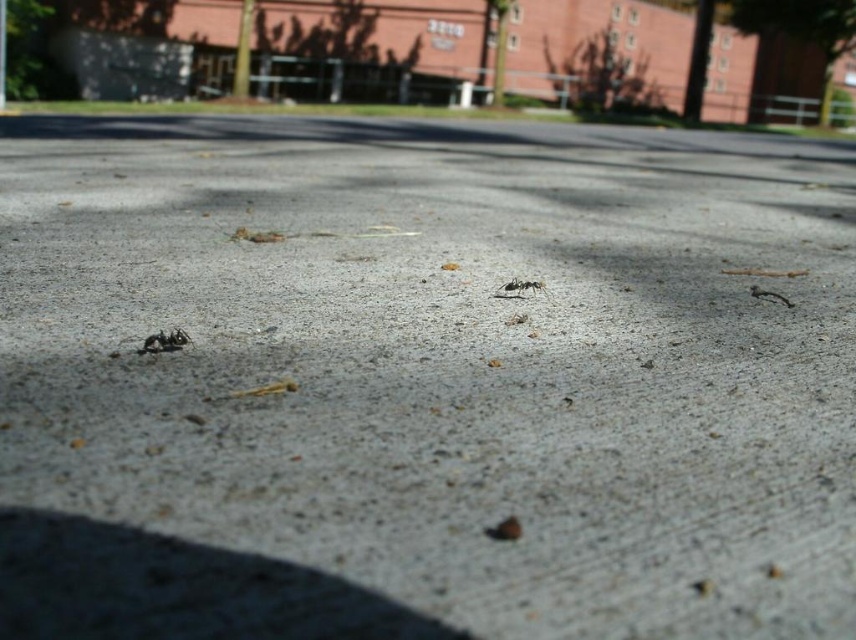
Question: Can you confirm if black matte ant at lower left is wider than black matte ant at center?

Choices:
 (A) no
 (B) yes

Answer: (A)

Question: Which of the following is the farthest from the observer?

Choices:
 (A) black matte ant at lower left
 (B) black matte ant at center

Answer: (B)

Question: Which point is farther from the camera taking this photo?

Choices:
 (A) (508, 289)
 (B) (788, 300)
 (C) (165, 337)

Answer: (B)

Question: Does black matte ant at lower left come in front of black matte ant at center?

Choices:
 (A) no
 (B) yes

Answer: (B)

Question: Can you confirm if black matte ant at lower left is positioned to the left of black matte ant at center?

Choices:
 (A) yes
 (B) no

Answer: (A)

Question: Which object is farther from the camera taking this photo?

Choices:
 (A) black matte ant at center
 (B) black matte ant at lower left

Answer: (A)